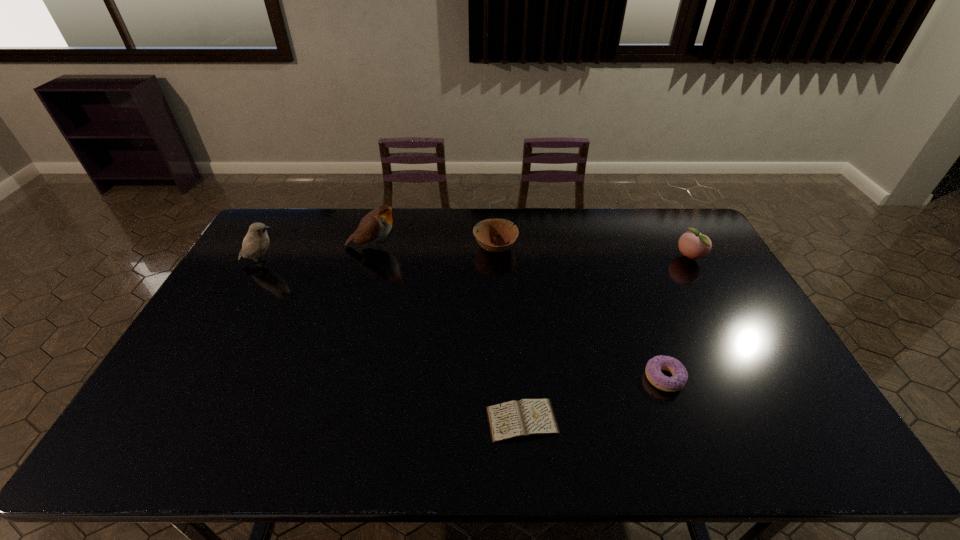
At what (x,y) coordinates should I click in order to perform the action: click on vacant region between the diary and the peach. Please return your answer as a coordinate pair (x, y). The height and width of the screenshot is (540, 960). Looking at the image, I should click on (606, 339).

This screenshot has width=960, height=540. In order to click on free space between the farther bird and the leftmost object in this screenshot , I will do `click(318, 255)`.

Locate an element on the screen. Image resolution: width=960 pixels, height=540 pixels. unoccupied area between the peach and the fifth object from right to left is located at coordinates (532, 252).

Find the location of a particular element. The width and height of the screenshot is (960, 540). vacant space that's between the fifth object from left to right and the diary is located at coordinates (593, 399).

The height and width of the screenshot is (540, 960). What are the coordinates of `free spot between the nearest object and the farther bird` in the screenshot? It's located at (447, 333).

Identify the location of free spot between the farther bird and the bowl. (435, 247).

You are a GUI agent. You are given a task and a screenshot of the screen. Output one action in this format:
    pyautogui.click(x=<x>, y=<y>)
    Task: Click on the vacant area that lies between the third shortest object and the fifth tallest object
    This screenshot has height=540, width=960.
    Given the screenshot: What is the action you would take?
    pyautogui.click(x=580, y=313)

Locate an element on the screen. The image size is (960, 540). vacant point located between the fifth farthest object and the shortest object is located at coordinates (593, 399).

The image size is (960, 540). Find the location of `the third closest object relative to the right bird`. the third closest object relative to the right bird is located at coordinates (525, 418).

Locate which object is the fifth closest to the fifth object from right to left. Please provide its 2D coordinates. Your answer should be formatted as a tuple, i.e. [(x, y)], where the tuple contains the x and y coordinates of a point satisfying the conditions above.

[(694, 245)]